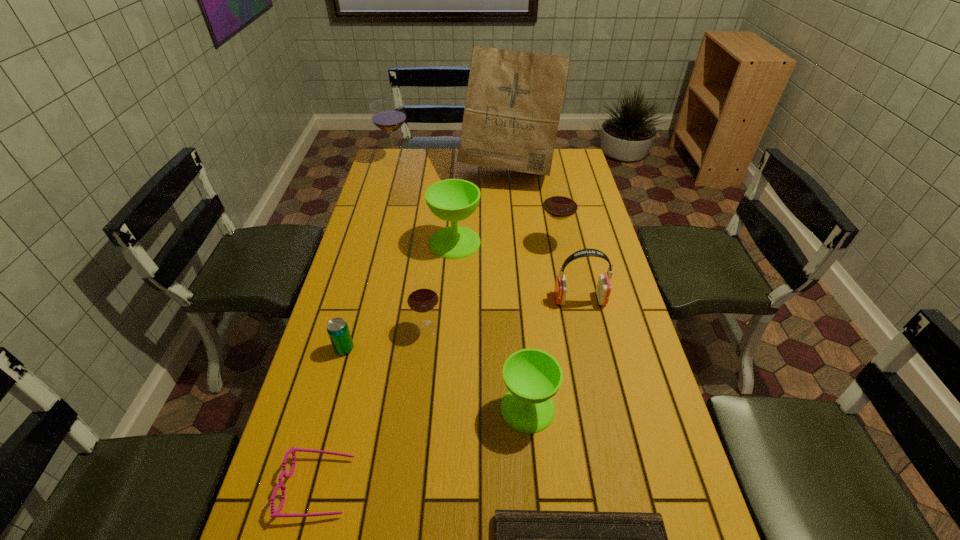
At what (x,y) coordinates should I click in order to perform the action: click on the nearest red wineglass. Please return your answer as a coordinate pair (x, y). The image size is (960, 540). Looking at the image, I should click on (422, 297).

Locate an element on the screen. Image resolution: width=960 pixels, height=540 pixels. the fifth nearest object is located at coordinates (422, 297).

Locate an element on the screen. Image resolution: width=960 pixels, height=540 pixels. the smaller green wineglass is located at coordinates (532, 376).

This screenshot has height=540, width=960. I want to click on the nearer green wineglass, so click(532, 376).

What are the coordinates of `the fourth nearest object` in the screenshot? It's located at (337, 329).

The width and height of the screenshot is (960, 540). In order to click on the eighth tallest object in this screenshot , I will do `click(337, 329)`.

This screenshot has height=540, width=960. I want to click on pink spectacles, so click(274, 513).

Where is `spectacles`? spectacles is located at coordinates (274, 513).

You are a GUI agent. You are given a task and a screenshot of the screen. Output one action in this format:
    pyautogui.click(x=<x>, y=<y>)
    Task: Click on the vacant space located 0.230m on the front of the brown grocery bag
    
    Given the screenshot: What is the action you would take?
    pyautogui.click(x=515, y=228)

The width and height of the screenshot is (960, 540). I want to click on free space located 0.100m on the front of the farthest wineglass, so (390, 182).